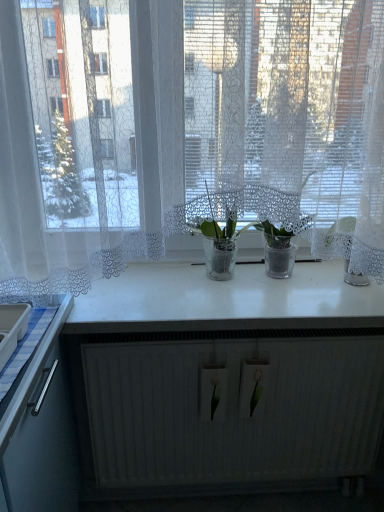
Question: From a real-world perspective, does white glossy counter top at center sit lower than transparent glass plants at center?

Choices:
 (A) no
 (B) yes

Answer: (B)

Question: Is white glossy counter top at center positioned with its back to transparent glass plants at center?

Choices:
 (A) yes
 (B) no

Answer: (B)

Question: Is white glossy counter top at center at the right side of transparent glass plants at center?

Choices:
 (A) yes
 (B) no

Answer: (A)

Question: Can you confirm if white glossy counter top at center is smaller than transparent glass plants at center?

Choices:
 (A) yes
 (B) no

Answer: (A)

Question: Is white glossy counter top at center oriented towards transparent glass plants at center?

Choices:
 (A) no
 (B) yes

Answer: (A)

Question: Do you think white glossy counter top at center is within transparent glass plants at center, or outside of it?

Choices:
 (A) outside
 (B) inside

Answer: (A)

Question: In the image, is white glossy counter top at center on the left side or the right side of transparent glass plants at center?

Choices:
 (A) left
 (B) right

Answer: (B)

Question: From a real-world perspective, relative to transparent glass plants at center, is white glossy counter top at center vertically above or below?

Choices:
 (A) above
 (B) below

Answer: (B)

Question: Is white glossy counter top at center taller or shorter than transparent glass plants at center?

Choices:
 (A) tall
 (B) short

Answer: (B)

Question: From the image's perspective, is transparent glass plants at center above or below white matte radiator at lower center?

Choices:
 (A) above
 (B) below

Answer: (A)

Question: Is point (48, 189) positioned closer to the camera than point (117, 373)?

Choices:
 (A) farther
 (B) closer

Answer: (B)

Question: Choose the correct answer: Is transparent glass plants at center inside white matte radiator at lower center or outside it?

Choices:
 (A) outside
 (B) inside

Answer: (A)

Question: From their relative heights in the image, would you say transparent glass plants at center is taller or shorter than white matte radiator at lower center?

Choices:
 (A) short
 (B) tall

Answer: (B)

Question: In terms of width, does white matte radiator at lower center look wider or thinner when compared to transparent glass plants at center?

Choices:
 (A) thin
 (B) wide

Answer: (A)

Question: Considering their positions, is white matte radiator at lower center located in front of or behind transparent glass plants at center?

Choices:
 (A) behind
 (B) front

Answer: (A)